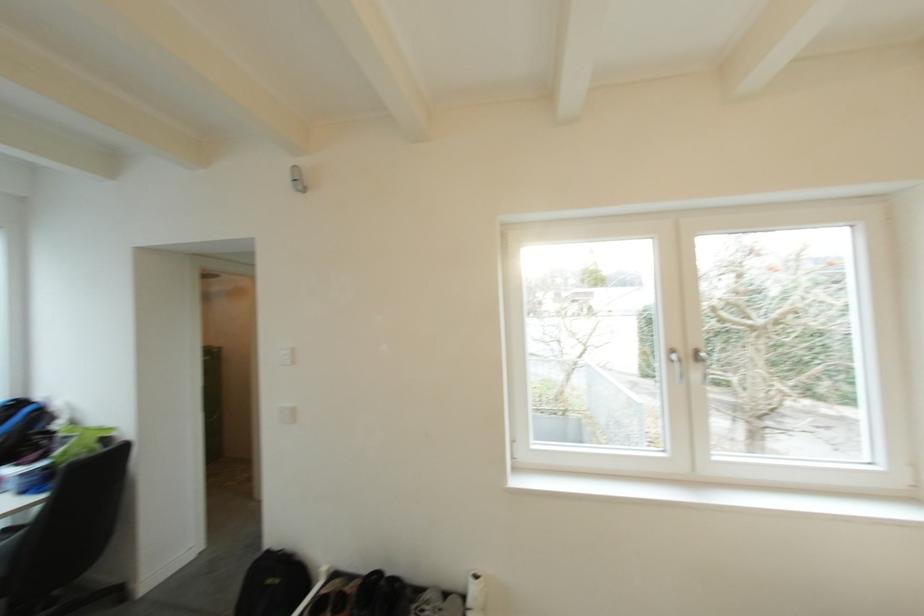
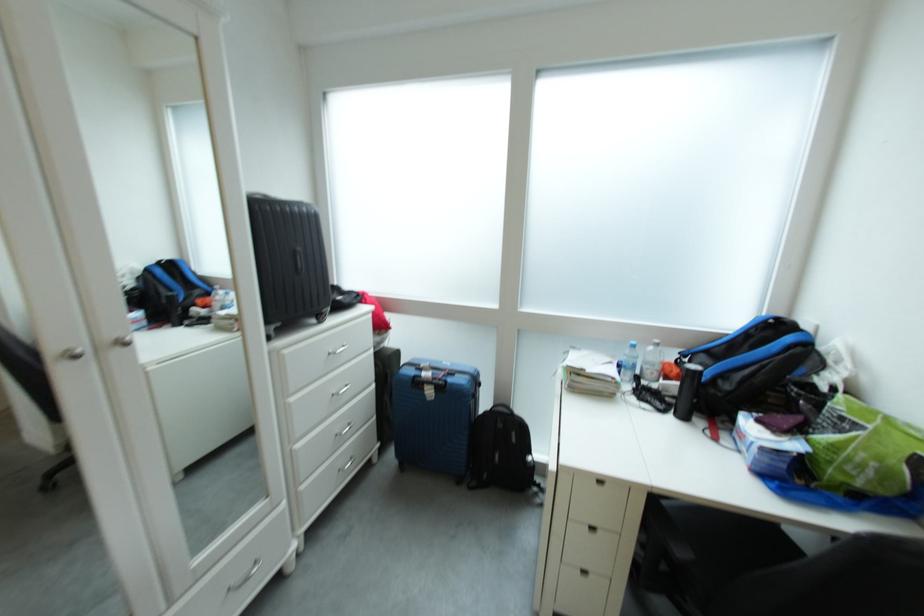
Question: I am providing you with two images of the same scene from different viewpoints. Please identify which objects are invisible in image2.

Choices:
 (A) blue suitcase handle
 (B) blue desk object
 (C) black chair sitting surface
 (D) black portable speaker

Answer: (C)